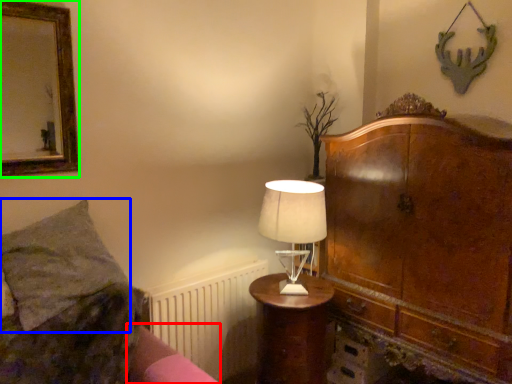
Question: Which object is positioned farthest from bed frame (highlighted by a red box)? Select from pillow (highlighted by a blue box) and picture frame (highlighted by a green box).

Choices:
 (A) pillow
 (B) picture frame

Answer: (B)